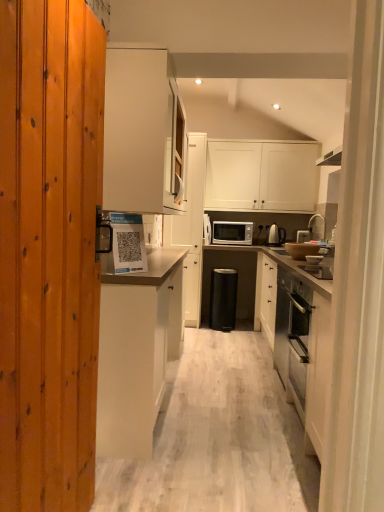
Question: Is white glossy cabinet at upper center, arranged as the 2th cabinetry when viewed from the right, smaller than white matte cabinet at upper center, acting as the 1th cabinetry starting from the right?

Choices:
 (A) no
 (B) yes

Answer: (A)

Question: Does white glossy cabinet at upper center, which is the 3th cabinetry in left-to-right order, have a greater width compared to white matte cabinet at upper center, which appears as the 4th cabinetry when viewed from the left?

Choices:
 (A) yes
 (B) no

Answer: (A)

Question: From the image's perspective, does white glossy cabinet at upper center, which is the 3th cabinetry in left-to-right order, appear higher than white matte cabinet at upper center, which appears as the 4th cabinetry when viewed from the left?

Choices:
 (A) yes
 (B) no

Answer: (B)

Question: Is white matte cabinet at upper center, which appears as the 4th cabinetry when viewed from the left, inside white glossy cabinet at upper center, which is the 3th cabinetry in left-to-right order?

Choices:
 (A) no
 (B) yes

Answer: (A)

Question: Can you confirm if white glossy cabinet at upper center, which is the 3th cabinetry in left-to-right order, is positioned to the right of white matte cabinet at upper center, which appears as the 4th cabinetry when viewed from the left?

Choices:
 (A) yes
 (B) no

Answer: (B)

Question: Does white glossy cabinet at upper center, which is the 3th cabinetry in left-to-right order, have a lesser width compared to white matte cabinet at upper center, which appears as the 4th cabinetry when viewed from the left?

Choices:
 (A) no
 (B) yes

Answer: (A)

Question: Is white matte cabinet at center, marked as the 1th cabinetry in a left-to-right arrangement, a part of white matte cabinet at upper center, which appears as the 4th cabinetry when viewed from the left?

Choices:
 (A) yes
 (B) no

Answer: (B)

Question: From the image's perspective, is white matte cabinet at upper center, which appears as the 4th cabinetry when viewed from the left, located beneath white matte cabinet at center, marked as the 1th cabinetry in a left-to-right arrangement?

Choices:
 (A) yes
 (B) no

Answer: (B)

Question: From the image's perspective, is white matte cabinet at upper center, acting as the 1th cabinetry starting from the right, on white matte cabinet at center, which is counted as the 4th cabinetry, starting from the right?

Choices:
 (A) yes
 (B) no

Answer: (A)

Question: Considering the relative sizes of white matte cabinet at upper center, acting as the 1th cabinetry starting from the right, and white matte cabinet at center, marked as the 1th cabinetry in a left-to-right arrangement, in the image provided, is white matte cabinet at upper center, acting as the 1th cabinetry starting from the right, wider than white matte cabinet at center, marked as the 1th cabinetry in a left-to-right arrangement,?

Choices:
 (A) no
 (B) yes

Answer: (A)

Question: Does white matte cabinet at upper center, acting as the 1th cabinetry starting from the right, appear on the left side of white matte cabinet at center, which is counted as the 4th cabinetry, starting from the right?

Choices:
 (A) yes
 (B) no

Answer: (B)

Question: From a real-world perspective, is white matte cabinet at upper center, acting as the 1th cabinetry starting from the right, located beneath white matte cabinet at center, which is counted as the 4th cabinetry, starting from the right?

Choices:
 (A) yes
 (B) no

Answer: (B)

Question: From a real-world perspective, is silver metallic faucet at upper right under white glossy cabinet at upper center, which is the 3th cabinetry in left-to-right order?

Choices:
 (A) yes
 (B) no

Answer: (B)